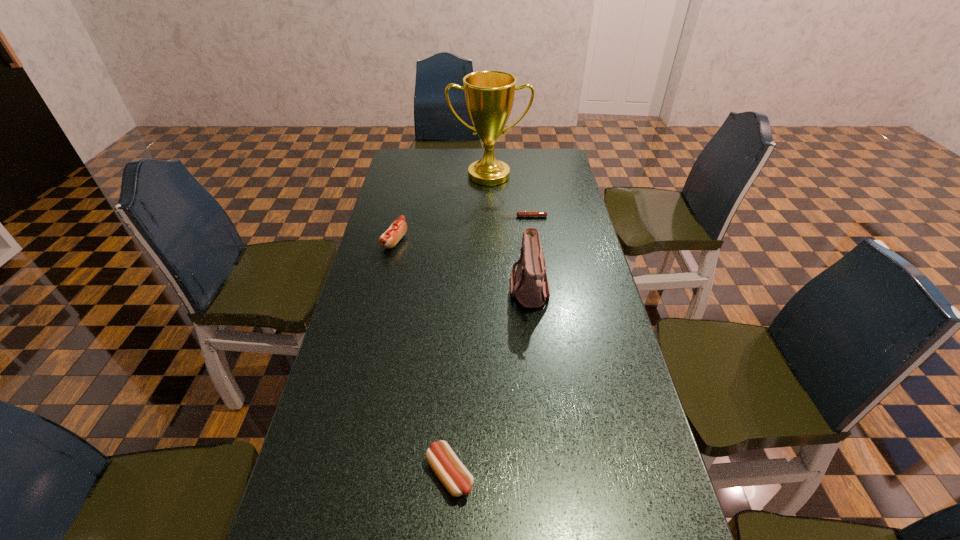
In the image, there is a desktop. At what (x,y) coordinates should I click in order to perform the action: click on vacant space at the far edge. Please return your answer as a coordinate pair (x, y). The height and width of the screenshot is (540, 960). Looking at the image, I should click on (452, 154).

This screenshot has height=540, width=960. In the image, there is a desktop. Identify the location of vacant space at the left edge. (353, 299).

Where is `vacant space at the right edge of the desktop`? The height and width of the screenshot is (540, 960). vacant space at the right edge of the desktop is located at coordinates (592, 366).

Where is `vacant space at the far left corner of the desktop`? vacant space at the far left corner of the desktop is located at coordinates (396, 173).

Find the location of a particular element. This screenshot has height=540, width=960. vacant space at the far right corner is located at coordinates 533,157.

Where is `vacant area that lies between the second shortest object and the tallest object`? The image size is (960, 540). vacant area that lies between the second shortest object and the tallest object is located at coordinates pyautogui.click(x=469, y=325).

Locate an element on the screen. The width and height of the screenshot is (960, 540). vacant area that lies between the fourth shortest object and the second sausage from left to right is located at coordinates (490, 382).

Find the location of a particular element. Image resolution: width=960 pixels, height=540 pixels. free space between the tallest object and the shoulder bag is located at coordinates (509, 233).

This screenshot has width=960, height=540. Find the location of `free area in between the leftmost sausage and the second tallest object`. free area in between the leftmost sausage and the second tallest object is located at coordinates (462, 266).

The height and width of the screenshot is (540, 960). What are the coordinates of `vacant space in between the tallest sausage and the farthest sausage` in the screenshot? It's located at (459, 229).